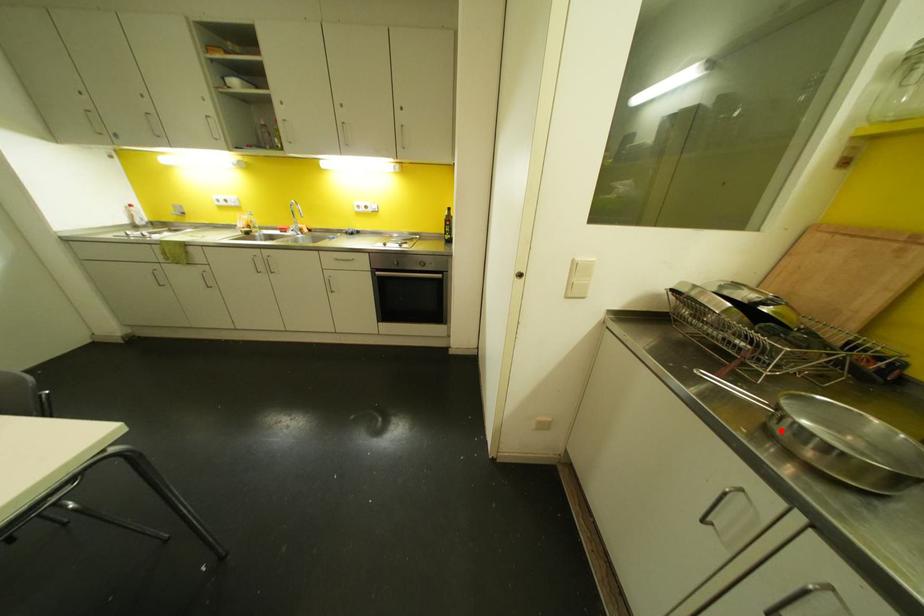
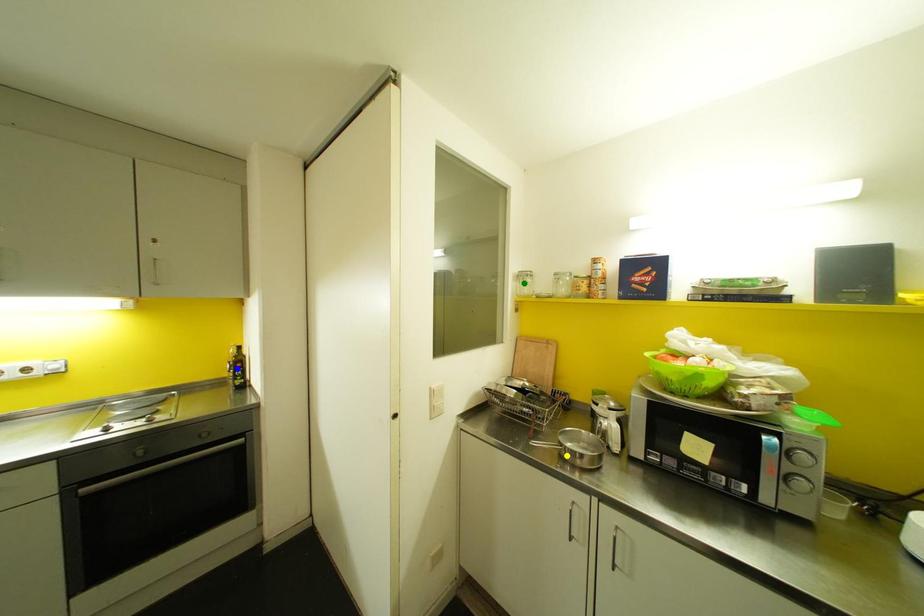
Question: I am providing you with two images of the same scene from different viewpoints. A red point is marked on the first image. You are given multiple points on the second image. In image 2, which mark is for the same physical point as the one in image 1?

Choices:
 (A) green point
 (B) yellow point
 (C) blue point

Answer: (B)